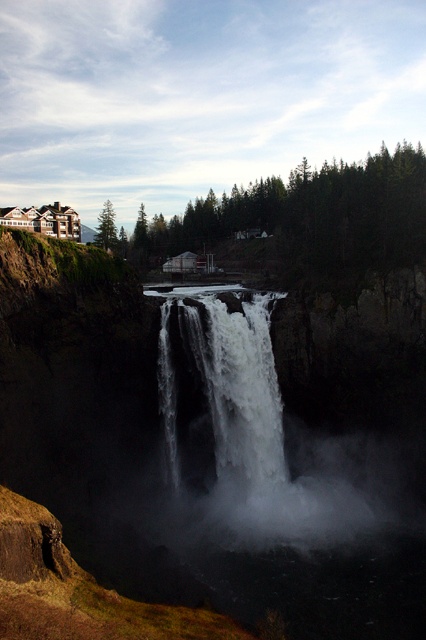
In the scene shown: You are standing at the edge of the dark pool below the waterfall. You notice a point marked at coordinates (262, 440). What can you observe at that point?

At point (262, 440), there is white misty steam at center, which is likely created by the forceful water cascading down the cliff and meeting the pool below.

You are standing at the base of the waterfall and looking up. There is a point marked at coordinates [305,218]. What object is located at that point?

The point at [305,218] marks the green matte tree at upper center.

You are an artist planning to paint the waterfall scene. You want to ensure that the green matte tree at upper center and the green matte tree at upper left are arranged in a way that reflects their actual positions. Which tree should you place higher in your painting?

The green matte tree at upper center should be placed higher in the painting because it is positioned over the green matte tree at upper left.